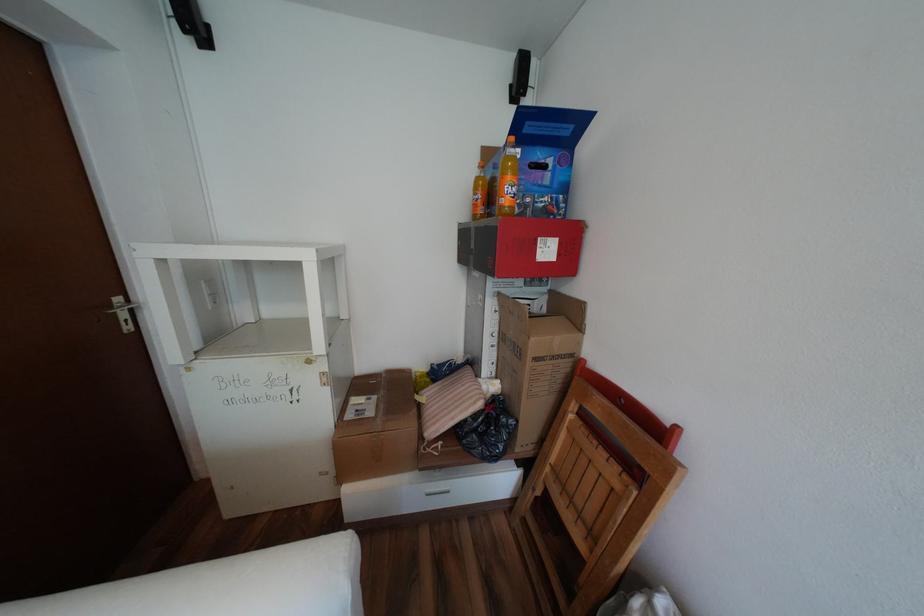
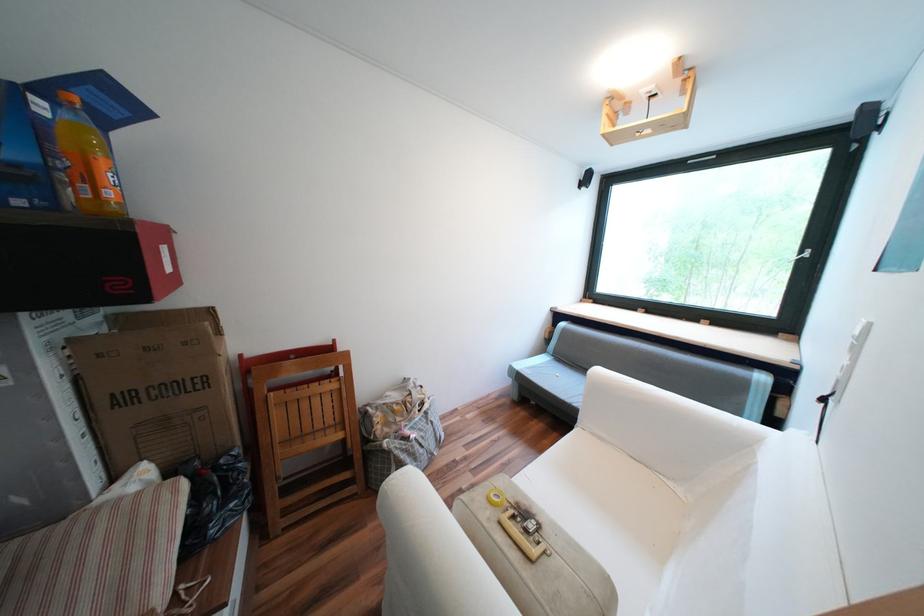
The point at (614, 455) is marked in the first image. Where is the corresponding point in the second image?

(325, 383)